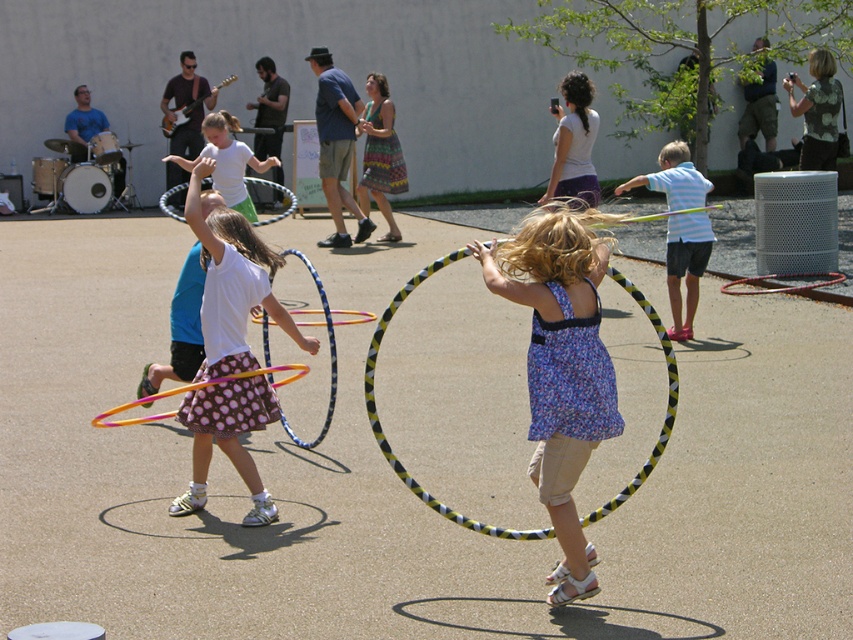
Who is higher up, white matte hula hoop at center or white plastic hula hoop at center?

white plastic hula hoop at center is above.

Between white matte hula hoop at center and white plastic hula hoop at center, which one has more height?

white plastic hula hoop at center is taller.

Between point (238, 124) and point (247, 180), which one is positioned in front?

Point (247, 180) is more forward.

At what (x,y) coordinates should I click in order to perform the action: click on white matte hula hoop at center. Please return your answer as a coordinate pair (x, y). This screenshot has width=853, height=640. Looking at the image, I should click on (227, 161).

Which is above, light blue striped shirt at right or white matte hula hoop at center?

white matte hula hoop at center

Is point (677, 168) farther from viewer compared to point (225, 132)?

No, it is in front of (225, 132).

Is point (660, 176) positioned before point (228, 120)?

That is True.

Where is `light blue striped shirt at right`? light blue striped shirt at right is located at coordinates (685, 266).

Between point (674, 381) and point (683, 330), which one is positioned in front?

Positioned in front is point (674, 381).

Is point (403, 483) positioned before point (677, 182)?

Yes, point (403, 483) is in front of point (677, 182).

Locate an element on the screen. The width and height of the screenshot is (853, 640). yellow and black striped hula hoop at center is located at coordinates (384, 435).